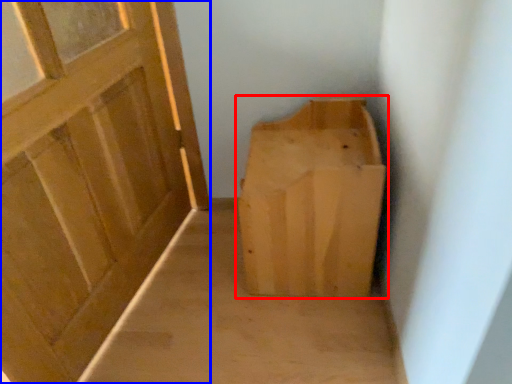
Question: Among these objects, which one is nearest to the camera, furniture (highlighted by a red box) or door (highlighted by a blue box)?

Choices:
 (A) furniture
 (B) door

Answer: (B)